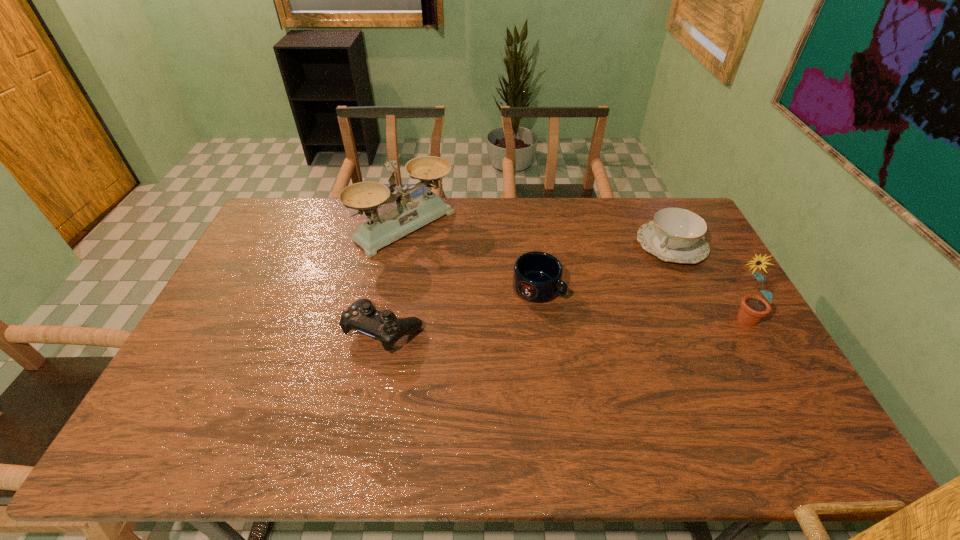
In the image, there is a desktop. Where is `vacant space at the far edge`? The width and height of the screenshot is (960, 540). vacant space at the far edge is located at coordinates (594, 203).

The height and width of the screenshot is (540, 960). What are the coordinates of `vacant area at the near edge` in the screenshot? It's located at (368, 411).

In the image, there is a desktop. Where is `vacant space at the left edge`? This screenshot has height=540, width=960. vacant space at the left edge is located at coordinates (220, 353).

This screenshot has width=960, height=540. Identify the location of vacant space at the right edge of the desktop. (693, 289).

Identify the location of vacant space at the far left corner. (301, 226).

Image resolution: width=960 pixels, height=540 pixels. Identify the location of free space between the control and the sunflower. (563, 325).

At what (x,y) coordinates should I click in order to perform the action: click on free space between the scale and the control. Please return your answer as a coordinate pair (x, y). The width and height of the screenshot is (960, 540). Looking at the image, I should click on (395, 278).

At what (x,y) coordinates should I click in order to perform the action: click on vacant area that lies between the chinaware and the scale. Please return your answer as a coordinate pair (x, y). Looking at the image, I should click on (539, 235).

Locate an element on the screen. This screenshot has width=960, height=540. free spot between the sunflower and the scale is located at coordinates (572, 273).

In order to click on free area in between the sunflower and the third object from right to left in this screenshot , I will do `click(638, 303)`.